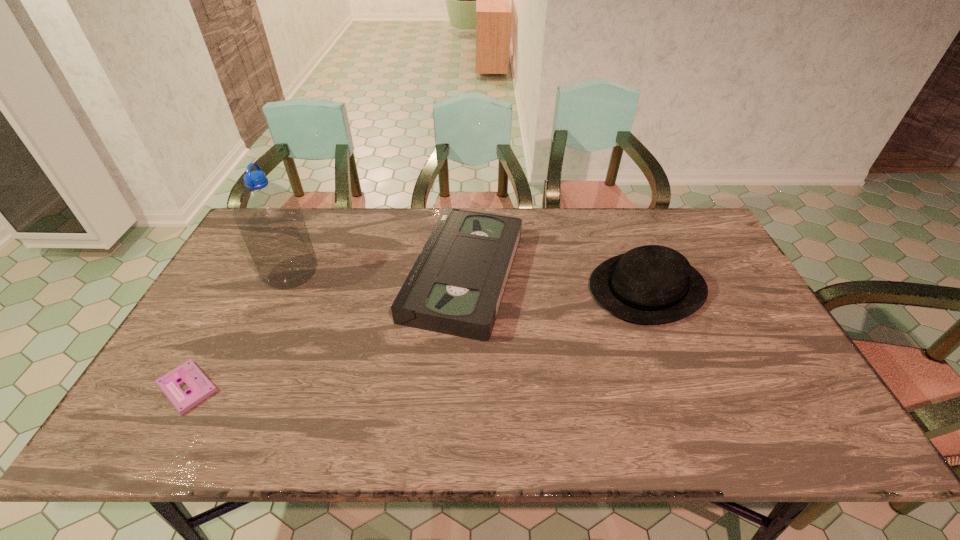
Where is `vacant area situated on the right of the nearer videotape`? This screenshot has width=960, height=540. vacant area situated on the right of the nearer videotape is located at coordinates (336, 388).

The image size is (960, 540). Find the location of `object that is at the far edge`. object that is at the far edge is located at coordinates (455, 287).

Identify the location of object that is at the near edge. (200, 387).

Image resolution: width=960 pixels, height=540 pixels. What are the coordinates of `water jug at the left edge` in the screenshot? It's located at (268, 216).

Where is `videotape positioned at the left edge`? The width and height of the screenshot is (960, 540). videotape positioned at the left edge is located at coordinates (200, 387).

At what (x,y) coordinates should I click in order to perform the action: click on object positioned at the right edge. Please return your answer as a coordinate pair (x, y). Looking at the image, I should click on (652, 284).

Find the location of `object that is at the near left corner`. object that is at the near left corner is located at coordinates (200, 387).

In the image, there is a desktop. Find the location of `free space at the far edge`. free space at the far edge is located at coordinates (597, 214).

The width and height of the screenshot is (960, 540). In the image, there is a desktop. What are the coordinates of `vacant space at the left edge` in the screenshot? It's located at (257, 303).

In the image, there is a desktop. Where is `free region at the right edge`? The height and width of the screenshot is (540, 960). free region at the right edge is located at coordinates (757, 326).